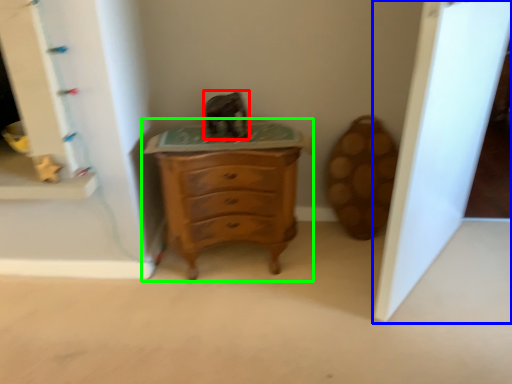
Question: Considering the real-world distances, which object is closest to animal (highlighted by a red box)? glass door (highlighted by a blue box) or chest of drawers (highlighted by a green box).

Choices:
 (A) glass door
 (B) chest of drawers

Answer: (B)